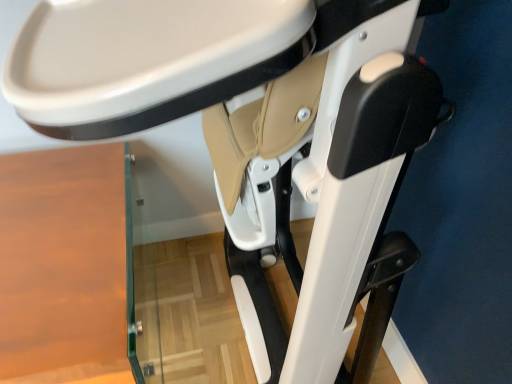
Measure the distance between wooden table at lower left and camera.

They are 23.67 inches apart.

What do you see at coordinates (63, 264) in the screenshot? I see `wooden table at lower left` at bounding box center [63, 264].

Locate an element on the screen. This screenshot has width=512, height=384. wooden table at lower left is located at coordinates (63, 264).

Locate an element on the screen. The height and width of the screenshot is (384, 512). wooden table at lower left is located at coordinates (63, 264).